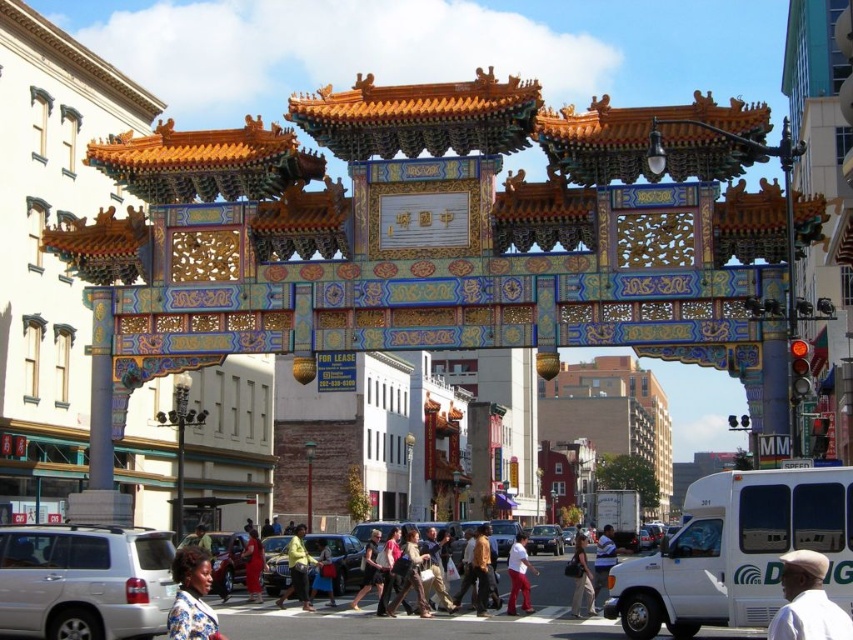
Does tan cotton pants at center have a greater width compared to metallic silver sedan at center?

Correct, the width of tan cotton pants at center exceeds that of metallic silver sedan at center.

Can you confirm if tan cotton pants at center is positioned above metallic silver sedan at center?

Indeed, tan cotton pants at center is positioned over metallic silver sedan at center.

The width and height of the screenshot is (853, 640). Identify the location of tan cotton pants at center. (581, 577).

Identify the location of matte white shirt at center. (518, 573).

You are a GUI agent. You are given a task and a screenshot of the screen. Output one action in this format:
    pyautogui.click(x=<x>, y=<y>)
    Task: Click on the matte white shirt at center
    The image size is (853, 640).
    Given the screenshot: What is the action you would take?
    pyautogui.click(x=518, y=573)

Locate an element on the screen. This screenshot has height=640, width=853. matte white shirt at center is located at coordinates (518, 573).

Does matte black jacket at center lie behind metallic silver sedan at center?

No, matte black jacket at center is in front of metallic silver sedan at center.

Between matte black jacket at center and metallic silver sedan at center, which one has more height?

With more height is matte black jacket at center.

Does point (367, 586) lie in front of point (538, 541)?

That is True.

The height and width of the screenshot is (640, 853). I want to click on matte black jacket at center, so click(370, 570).